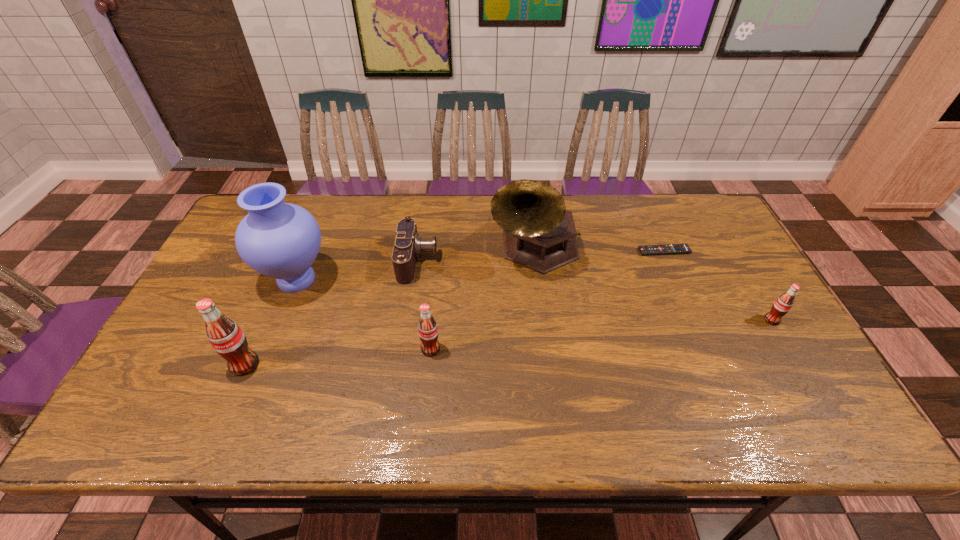
Find the location of a particular element. This screenshot has width=960, height=540. the leftmost soda is located at coordinates (225, 336).

Image resolution: width=960 pixels, height=540 pixels. I want to click on the tallest soda, so click(x=225, y=336).

The image size is (960, 540). What are the coordinates of `the fourth shortest object` in the screenshot? It's located at (428, 333).

Where is `the second soda from left to right`? The image size is (960, 540). the second soda from left to right is located at coordinates (428, 333).

I want to click on the fifth tallest object, so click(782, 305).

The width and height of the screenshot is (960, 540). Identify the location of the farthest soda. (782, 305).

At what (x,y) coordinates should I click in order to perform the action: click on vase. Please return your answer as a coordinate pair (x, y). Looking at the image, I should click on (280, 240).

In order to click on the fifth object from left to right in this screenshot , I will do `click(539, 233)`.

This screenshot has height=540, width=960. Find the location of `the shortest object`. the shortest object is located at coordinates (667, 249).

Locate an element on the screen. the sixth object from left to right is located at coordinates (667, 249).